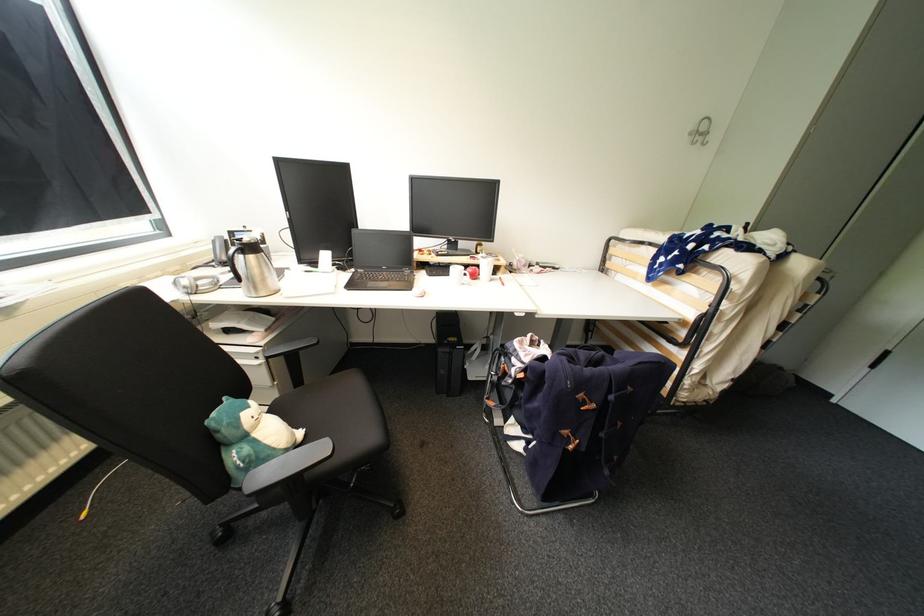
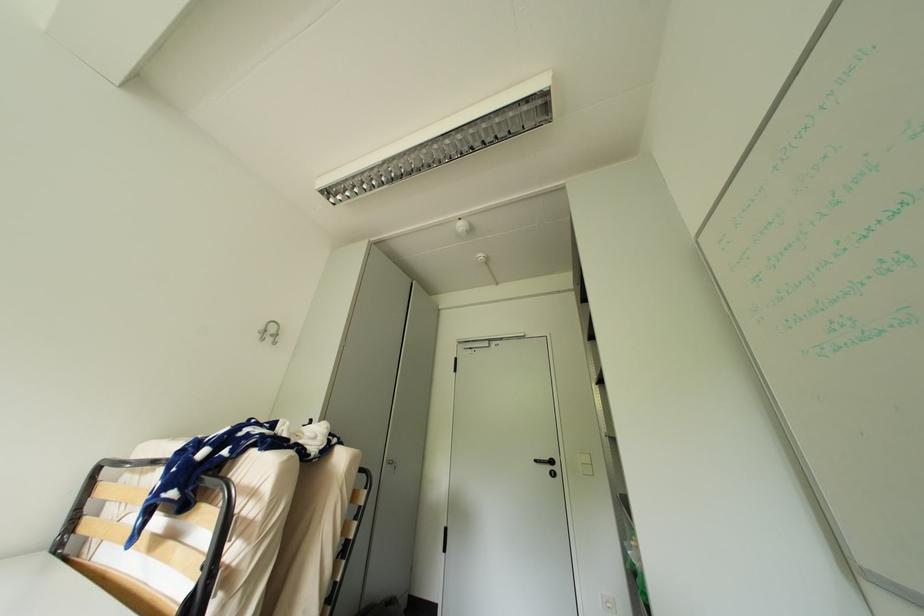
The images are taken continuously from a first-person perspective. In which direction is your viewpoint rotating?

The camera rotated toward right-up.